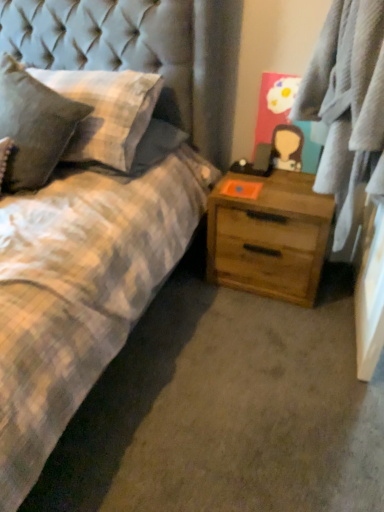
Image resolution: width=384 pixels, height=512 pixels. What do you see at coordinates (347, 103) in the screenshot?
I see `plaid fabric at right` at bounding box center [347, 103].

This screenshot has height=512, width=384. What do you see at coordinates (33, 126) in the screenshot? I see `plaid fabric pillow at left, which is the second pillow from right to left` at bounding box center [33, 126].

Identify the location of light brown wood chest of drawers at center-right. (269, 236).

Is plaid fabric at right looking in the opposite direction of light brown wood chest of drawers at center-right?

No, plaid fabric at right is not facing away from light brown wood chest of drawers at center-right.

Considering the positions of objects plaid fabric at right and light brown wood chest of drawers at center-right in the image provided, who is more to the left, plaid fabric at right or light brown wood chest of drawers at center-right?

Positioned to the left is light brown wood chest of drawers at center-right.

In terms of width, does plaid fabric at right look wider or thinner when compared to light brown wood chest of drawers at center-right?

In the image, plaid fabric at right appears to be more narrow than light brown wood chest of drawers at center-right.

Is point (37, 142) closer or farther from the camera than point (61, 88)?

Point (37, 142).

Which of these two, plaid fabric pillow at left, which is the second pillow from right to left, or textured gray pillow at left, which appears as the first pillow when viewed from the right, is smaller?

With smaller size is textured gray pillow at left, which appears as the first pillow when viewed from the right.

Can you confirm if plaid fabric pillow at left, marked as the first pillow in a left-to-right arrangement, is shorter than textured gray pillow at left, marked as the 2th pillow in a left-to-right arrangement?

No, plaid fabric pillow at left, marked as the first pillow in a left-to-right arrangement, is not shorter than textured gray pillow at left, marked as the 2th pillow in a left-to-right arrangement.

In terms of width, does plaid fabric pillow at left, which is the second pillow from right to left, look wider or thinner when compared to textured gray pillow at left, marked as the 2th pillow in a left-to-right arrangement?

Clearly, plaid fabric pillow at left, which is the second pillow from right to left, has more width compared to textured gray pillow at left, marked as the 2th pillow in a left-to-right arrangement.

Could you measure the distance between plaid fabric at right and textured gray pillow at left, marked as the 2th pillow in a left-to-right arrangement?

plaid fabric at right is 29.47 inches from textured gray pillow at left, marked as the 2th pillow in a left-to-right arrangement.

Which point is more forward, (x=319, y=41) or (x=117, y=150)?

The point (x=319, y=41) is closer.

Is plaid fabric at right oriented away from textured gray pillow at left, which appears as the first pillow when viewed from the right?

No, textured gray pillow at left, which appears as the first pillow when viewed from the right, is not at the back of plaid fabric at right.

Does plaid fabric at right touch textured gray pillow at left, marked as the 2th pillow in a left-to-right arrangement?

There is a gap between plaid fabric at right and textured gray pillow at left, marked as the 2th pillow in a left-to-right arrangement.

Is textured gray pillow at left, which appears as the first pillow when viewed from the right, in front of light brown wood chest of drawers at center-right?

Yes, it is in front of light brown wood chest of drawers at center-right.

Is textured gray pillow at left, marked as the 2th pillow in a left-to-right arrangement, facing towards light brown wood chest of drawers at center-right?

No, textured gray pillow at left, marked as the 2th pillow in a left-to-right arrangement, is not facing towards light brown wood chest of drawers at center-right.

From a real-world perspective, which is physically above, plaid fabric at right or plaid fabric pillow at left, marked as the first pillow in a left-to-right arrangement?

In real-world perspective, plaid fabric at right is above.

Considering the sizes of plaid fabric at right and plaid fabric pillow at left, marked as the first pillow in a left-to-right arrangement, in the image, is plaid fabric at right taller or shorter than plaid fabric pillow at left, marked as the first pillow in a left-to-right arrangement,?

Clearly, plaid fabric at right is taller compared to plaid fabric pillow at left, marked as the first pillow in a left-to-right arrangement.

In the scene shown: Which object is positioned more to the right, plaid fabric at right or plaid fabric pillow at left, marked as the first pillow in a left-to-right arrangement?

Positioned to the right is plaid fabric at right.

Looking at the image, does plaid fabric pillow at left, marked as the first pillow in a left-to-right arrangement, seem bigger or smaller compared to light brown wood chest of drawers at center-right?

Considering their sizes, plaid fabric pillow at left, marked as the first pillow in a left-to-right arrangement, takes up more space than light brown wood chest of drawers at center-right.

Visually, is plaid fabric pillow at left, which is the second pillow from right to left, positioned to the left or to the right of light brown wood chest of drawers at center-right?

plaid fabric pillow at left, which is the second pillow from right to left, is positioned on light brown wood chest of drawers at center-right's left side.

Looking at this image, from a real-world perspective, relative to light brown wood chest of drawers at center-right, is plaid fabric pillow at left, marked as the first pillow in a left-to-right arrangement, vertically above or below?

Clearly, from a real-world perspective, plaid fabric pillow at left, marked as the first pillow in a left-to-right arrangement, is above light brown wood chest of drawers at center-right.

How different are the orientations of plaid fabric pillow at left, which is the second pillow from right to left, and light brown wood chest of drawers at center-right in degrees?

The angular difference between plaid fabric pillow at left, which is the second pillow from right to left, and light brown wood chest of drawers at center-right is 11 degrees.

Does light brown wood chest of drawers at center-right have a greater width compared to textured gray pillow at left, which appears as the first pillow when viewed from the right?

No, light brown wood chest of drawers at center-right is not wider than textured gray pillow at left, which appears as the first pillow when viewed from the right.

Does point (287, 241) come farther from viewer compared to point (118, 147)?

Yes.

Locate an element on the screen. The image size is (384, 512). the chest of drawers that is under the textured gray pillow at left, marked as the 2th pillow in a left-to-right arrangement (from a real-world perspective) is located at coordinates (269, 236).

This screenshot has width=384, height=512. I want to click on chest of drawers below the plaid fabric at right (from the image's perspective), so click(269, 236).

What are the coordinates of `pillow to the left of textured gray pillow at left, marked as the 2th pillow in a left-to-right arrangement` in the screenshot? It's located at (33, 126).

Considering their positions, is light brown wood chest of drawers at center-right positioned closer to plaid fabric at right than plaid fabric pillow at left, marked as the first pillow in a left-to-right arrangement?

Based on the image, light brown wood chest of drawers at center-right appears to be nearer to plaid fabric at right.

Considering their positions, is textured gray pillow at left, which appears as the first pillow when viewed from the right, positioned closer to plaid fabric pillow at left, marked as the first pillow in a left-to-right arrangement, than plaid fabric at right?

textured gray pillow at left, which appears as the first pillow when viewed from the right.

When comparing their distances from light brown wood chest of drawers at center-right, does plaid fabric pillow at left, marked as the first pillow in a left-to-right arrangement, or textured gray pillow at left, marked as the 2th pillow in a left-to-right arrangement, seem further?

The object further to light brown wood chest of drawers at center-right is plaid fabric pillow at left, marked as the first pillow in a left-to-right arrangement.

Considering their positions, is plaid fabric pillow at left, which is the second pillow from right to left, positioned further to plaid fabric at right than light brown wood chest of drawers at center-right?

plaid fabric pillow at left, which is the second pillow from right to left, is positioned further to the anchor plaid fabric at right.

Based on their spatial positions, is light brown wood chest of drawers at center-right or plaid fabric pillow at left, which is the second pillow from right to left, further from textured gray pillow at left, which appears as the first pillow when viewed from the right?

The object further to textured gray pillow at left, which appears as the first pillow when viewed from the right, is light brown wood chest of drawers at center-right.

Looking at the image, which one is located further to textured gray pillow at left, which appears as the first pillow when viewed from the right, plaid fabric at right or plaid fabric pillow at left, which is the second pillow from right to left?

plaid fabric at right is further to textured gray pillow at left, which appears as the first pillow when viewed from the right.

From the image, which object appears to be nearer to plaid fabric pillow at left, marked as the first pillow in a left-to-right arrangement, light brown wood chest of drawers at center-right or plaid fabric at right?

The object closer to plaid fabric pillow at left, marked as the first pillow in a left-to-right arrangement, is light brown wood chest of drawers at center-right.

Which object lies further to the anchor point textured gray pillow at left, marked as the 2th pillow in a left-to-right arrangement, plaid fabric pillow at left, marked as the first pillow in a left-to-right arrangement, or light brown wood chest of drawers at center-right?

light brown wood chest of drawers at center-right lies further to textured gray pillow at left, marked as the 2th pillow in a left-to-right arrangement, than the other object.

I want to click on pillow between plaid fabric pillow at left, marked as the first pillow in a left-to-right arrangement, and light brown wood chest of drawers at center-right from left to right, so click(106, 112).

Where is `the chest of drawers located between textured gray pillow at left, which appears as the first pillow when viewed from the right, and plaid fabric at right in the left-right direction`? The image size is (384, 512). the chest of drawers located between textured gray pillow at left, which appears as the first pillow when viewed from the right, and plaid fabric at right in the left-right direction is located at coordinates tap(269, 236).

In order to click on pillow between plaid fabric pillow at left, marked as the first pillow in a left-to-right arrangement, and plaid fabric at right, in the horizontal direction in this screenshot , I will do `click(106, 112)`.

Where is `chest of drawers between plaid fabric pillow at left, which is the second pillow from right to left, and plaid fabric at right, in the horizontal direction`? The width and height of the screenshot is (384, 512). chest of drawers between plaid fabric pillow at left, which is the second pillow from right to left, and plaid fabric at right, in the horizontal direction is located at coordinates (269, 236).